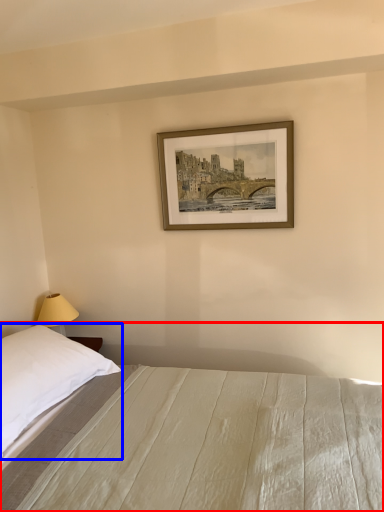
Question: Among these objects, which one is nearest to the camera, bed (highlighted by a red box) or pillow (highlighted by a blue box)?

Choices:
 (A) bed
 (B) pillow

Answer: (A)